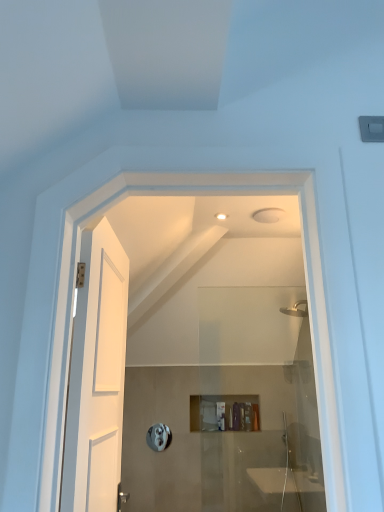
Locate an element on the screen. The width and height of the screenshot is (384, 512). translucent plastic container at center, which is counted as the first toiletry, starting from the left is located at coordinates (248, 416).

In order to face matte plastic toiletry at center, the first toiletry positioned from the right, should I rotate leftwards or rightwards?

It's best to rotate right around 8.665 degrees.

Measure the distance between point [158,447] and camera.

Point [158,447] and camera are 3.46 meters apart from each other.

Locate an element on the screen. The image size is (384, 512). translucent plastic container at center, which is counted as the first toiletry, starting from the left is located at coordinates (248, 416).

Does point (256, 419) lie behind point (160, 439)?

Yes, it is behind point (160, 439).

Would you say matte plastic toiletry at center, which is counted as the 2th toiletry, starting from the left, is inside or outside silver metallic towel bar at center?

matte plastic toiletry at center, which is counted as the 2th toiletry, starting from the left, is spatially situated outside silver metallic towel bar at center.

From the image's perspective, which is below, matte plastic toiletry at center, the first toiletry positioned from the right, or silver metallic towel bar at center?

silver metallic towel bar at center, from the image's perspective.

From the picture: What's the angular difference between matte plastic toiletry at center, the first toiletry positioned from the right, and silver metallic towel bar at center's facing directions?

0.342 degrees separate the facing orientations of matte plastic toiletry at center, the first toiletry positioned from the right, and silver metallic towel bar at center.

Is silver metallic towel bar at center turned away from white wooden door at left?

No, white wooden door at left is not at the back of silver metallic towel bar at center.

The height and width of the screenshot is (512, 384). Find the location of `towel bar on the right of the white wooden door at left`. towel bar on the right of the white wooden door at left is located at coordinates (159, 437).

Does silver metallic towel bar at center appear on the left side of white wooden door at left?

Incorrect, silver metallic towel bar at center is not on the left side of white wooden door at left.

Is white wooden door at left located within silver metallic towel bar at center?

No, white wooden door at left is not inside silver metallic towel bar at center.

Can matte plastic toiletry at center, the first toiletry positioned from the right, be found inside white wooden door at left?

Actually, matte plastic toiletry at center, the first toiletry positioned from the right, is outside white wooden door at left.

Looking at this image, is white wooden door at left looking in the opposite direction of matte plastic toiletry at center, the first toiletry positioned from the right?

No, white wooden door at left is not facing away from matte plastic toiletry at center, the first toiletry positioned from the right.

Considering the sizes of objects white wooden door at left and matte plastic toiletry at center, the first toiletry positioned from the right, in the image provided, who is bigger, white wooden door at left or matte plastic toiletry at center, the first toiletry positioned from the right,?

white wooden door at left is bigger.

From the image's perspective, who appears lower, white wooden door at left or matte plastic toiletry at center, the first toiletry positioned from the right?

matte plastic toiletry at center, the first toiletry positioned from the right, from the image's perspective.

Is silver metallic towel bar at center smaller than matte plastic toiletry at center, which is counted as the 2th toiletry, starting from the left?

Yes, silver metallic towel bar at center is smaller than matte plastic toiletry at center, which is counted as the 2th toiletry, starting from the left.

Considering the positions of points (154, 435) and (255, 407), is point (154, 435) closer to camera compared to point (255, 407)?

Yes, it is.

From a real-world perspective, is silver metallic towel bar at center positioned above or below matte plastic toiletry at center, the first toiletry positioned from the right?

Answer: silver metallic towel bar at center is below matte plastic toiletry at center, the first toiletry positioned from the right.

Is the position of silver metallic towel bar at center less distant than that of matte plastic toiletry at center, the first toiletry positioned from the right?

Yes, it is in front of matte plastic toiletry at center, the first toiletry positioned from the right.

From a real-world perspective, is silver metallic towel bar at center physically above translucent plastic container at center, the 2th toiletry viewed from the right?

No, from a real-world perspective, silver metallic towel bar at center is not on top of translucent plastic container at center, the 2th toiletry viewed from the right.

Is silver metallic towel bar at center far from translucent plastic container at center, which is counted as the first toiletry, starting from the left?

No.

Identify the location of towel bar on the left of translucent plastic container at center, the 2th toiletry viewed from the right. (159, 437).

Considering the positions of points (165, 447) and (249, 416), is point (165, 447) farther from camera compared to point (249, 416)?

No, it is not.

In the scene shown: Which is more to the right, translucent plastic container at center, which is counted as the first toiletry, starting from the left, or matte plastic toiletry at center, which is counted as the 2th toiletry, starting from the left?

From the viewer's perspective, matte plastic toiletry at center, which is counted as the 2th toiletry, starting from the left, appears more on the right side.

Between translucent plastic container at center, which is counted as the first toiletry, starting from the left, and matte plastic toiletry at center, the first toiletry positioned from the right, which one has larger size?

With larger size is translucent plastic container at center, which is counted as the first toiletry, starting from the left.

From the image's perspective, which one is positioned higher, translucent plastic container at center, the 2th toiletry viewed from the right, or matte plastic toiletry at center, the first toiletry positioned from the right?

translucent plastic container at center, the 2th toiletry viewed from the right.

Between point (69, 413) and point (162, 448), which one is positioned behind?

The point (162, 448) is farther.

Would you say white wooden door at left is inside or outside silver metallic towel bar at center?

white wooden door at left is located beyond the bounds of silver metallic towel bar at center.

Between white wooden door at left and silver metallic towel bar at center, which one has less height?

silver metallic towel bar at center.

Based on the photo, can you tell me how much white wooden door at left and silver metallic towel bar at center differ in facing direction?

85.7 degrees separate the facing orientations of white wooden door at left and silver metallic towel bar at center.

You are a GUI agent. You are given a task and a screenshot of the screen. Output one action in this format:
    pyautogui.click(x=<x>, y=<y>)
    Task: Click on the towel bar that appears in front of the matte plastic toiletry at center, which is counted as the 2th toiletry, starting from the left
    
    Given the screenshot: What is the action you would take?
    pyautogui.click(x=159, y=437)

You are a GUI agent. You are given a task and a screenshot of the screen. Output one action in this format:
    pyautogui.click(x=<x>, y=<y>)
    Task: Click on the door that is above the silver metallic towel bar at center (from a real-world perspective)
    
    Given the screenshot: What is the action you would take?
    pyautogui.click(x=97, y=376)

From the image, which object appears to be farther from white wooden door at left, silver metallic towel bar at center or matte plastic toiletry at center, the first toiletry positioned from the right?

matte plastic toiletry at center, the first toiletry positioned from the right, is further to white wooden door at left.

Looking at this image, estimate the real-world distances between objects in this image. Which object is further from white wooden door at left, translucent plastic container at center, the 2th toiletry viewed from the right, or silver metallic towel bar at center?

translucent plastic container at center, the 2th toiletry viewed from the right, is positioned further to the anchor white wooden door at left.

Which object lies further to the anchor point translucent plastic container at center, the 2th toiletry viewed from the right, matte plastic toiletry at center, which is counted as the 2th toiletry, starting from the left, or white wooden door at left?

Based on the image, white wooden door at left appears to be further to translucent plastic container at center, the 2th toiletry viewed from the right.

Which object lies nearer to the anchor point white wooden door at left, silver metallic towel bar at center or translucent plastic container at center, which is counted as the first toiletry, starting from the left?

The object closer to white wooden door at left is silver metallic towel bar at center.

Considering their positions, is white wooden door at left positioned further to translucent plastic container at center, the 2th toiletry viewed from the right, than matte plastic toiletry at center, which is counted as the 2th toiletry, starting from the left?

white wooden door at left.

When comparing their distances from silver metallic towel bar at center, does translucent plastic container at center, which is counted as the first toiletry, starting from the left, or white wooden door at left seem closer?

The object closer to silver metallic towel bar at center is translucent plastic container at center, which is counted as the first toiletry, starting from the left.

From the image, which object appears to be farther from translucent plastic container at center, which is counted as the first toiletry, starting from the left, white wooden door at left or silver metallic towel bar at center?

white wooden door at left is positioned further to the anchor translucent plastic container at center, which is counted as the first toiletry, starting from the left.

Estimate the real-world distances between objects in this image. Which object is closer to translucent plastic container at center, which is counted as the first toiletry, starting from the left, matte plastic toiletry at center, which is counted as the 2th toiletry, starting from the left, or silver metallic towel bar at center?

The object closer to translucent plastic container at center, which is counted as the first toiletry, starting from the left, is matte plastic toiletry at center, which is counted as the 2th toiletry, starting from the left.

What are the coordinates of `toiletry between white wooden door at left and matte plastic toiletry at center, the first toiletry positioned from the right, along the z-axis` in the screenshot? It's located at (248, 416).

You are a GUI agent. You are given a task and a screenshot of the screen. Output one action in this format:
    pyautogui.click(x=<x>, y=<y>)
    Task: Click on the toiletry situated between silver metallic towel bar at center and matte plastic toiletry at center, the first toiletry positioned from the right, from left to right
    
    Given the screenshot: What is the action you would take?
    pyautogui.click(x=248, y=416)

Image resolution: width=384 pixels, height=512 pixels. I want to click on towel bar between white wooden door at left and matte plastic toiletry at center, the first toiletry positioned from the right, in the front-back direction, so click(x=159, y=437).

Image resolution: width=384 pixels, height=512 pixels. Find the location of `towel bar between white wooden door at left and translucent plastic container at center, which is counted as the first toiletry, starting from the left, along the z-axis`. towel bar between white wooden door at left and translucent plastic container at center, which is counted as the first toiletry, starting from the left, along the z-axis is located at coordinates (159, 437).